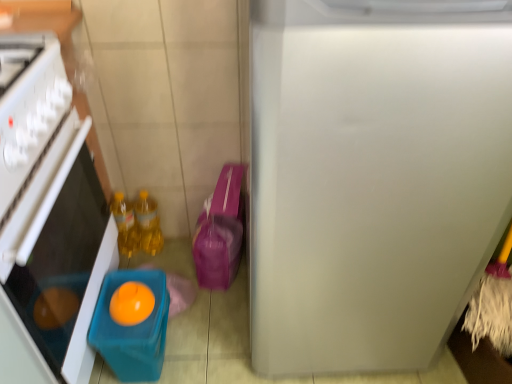
Question: Considering the positions of translucent plastic container at left and matte plastic container at lower left in the image, is translucent plastic container at left wider or thinner than matte plastic container at lower left?

Choices:
 (A) wide
 (B) thin

Answer: (A)

Question: From the image's perspective, is translucent plastic container at left located above or below matte plastic container at lower left?

Choices:
 (A) below
 (B) above

Answer: (B)

Question: Estimate the real-world distances between objects in this image. Which object is farther from the orange matte/orange at lower left?

Choices:
 (A) matte plastic container at lower left
 (B) yellow translucent bottles at center, which is the second bottle in left-to-right order
 (C) translucent yellow bottle at lower left, the first bottle positioned from the left
 (D) translucent plastic container at left
 (E) white matte refrigerator at right

Answer: (E)

Question: Based on their relative distances, which object is farther from the yellow translucent bottles at center, which is the second bottle in left-to-right order?

Choices:
 (A) matte plastic container at lower left
 (B) translucent plastic container at left
 (C) translucent yellow bottle at lower left, the first bottle positioned from the left
 (D) white matte refrigerator at right
 (E) orange matte/orange at lower left

Answer: (D)